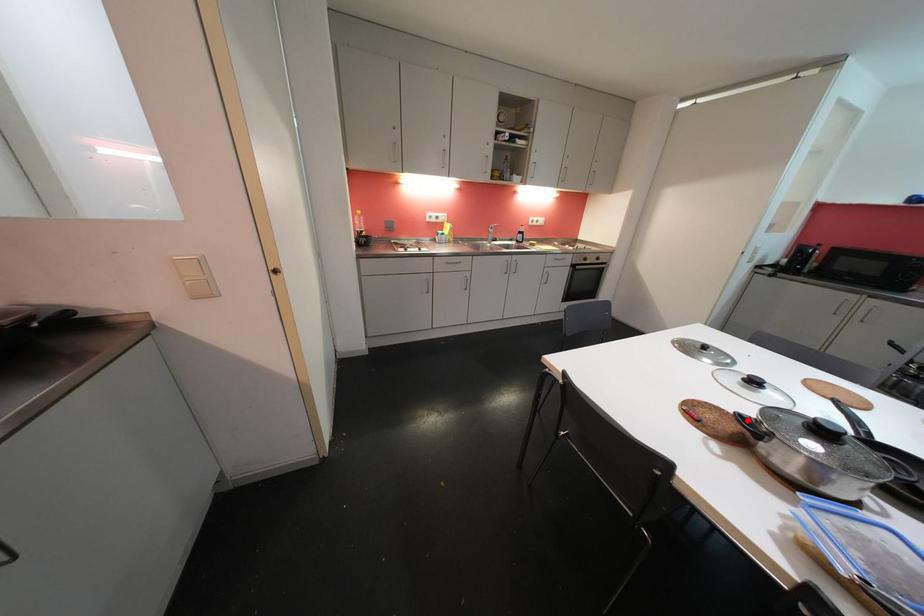
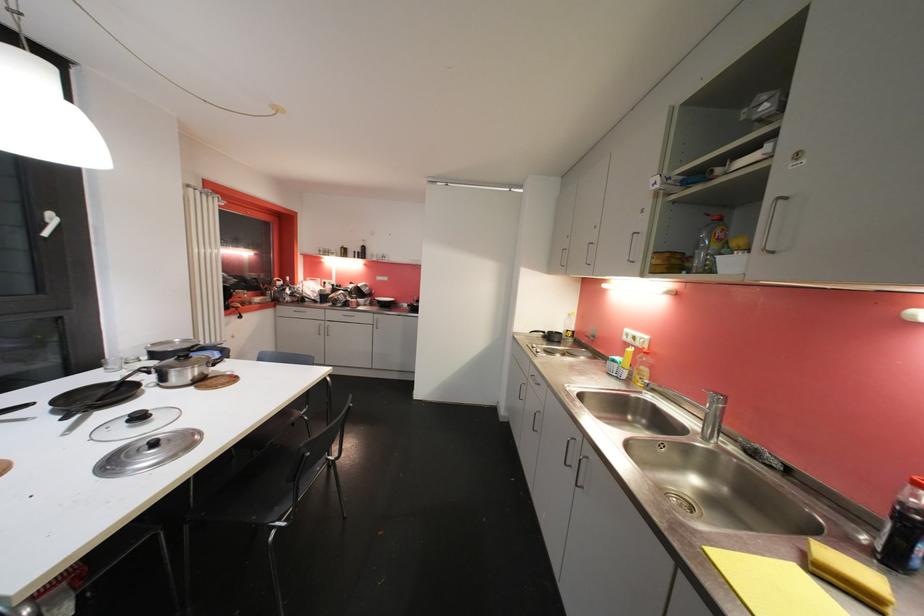
In the second image, find the point that corresponds to the highlighted location in the first image.

(221, 367)